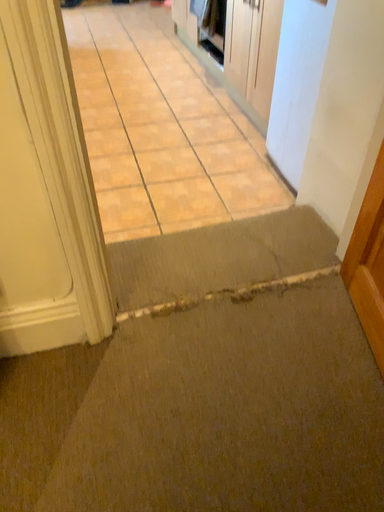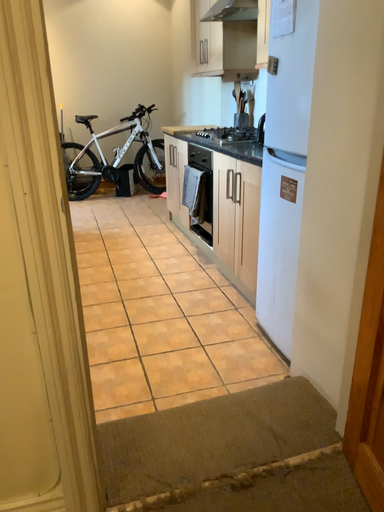
Question: How did the camera likely rotate when shooting the video?

Choices:
 (A) rotated upward
 (B) rotated downward

Answer: (A)